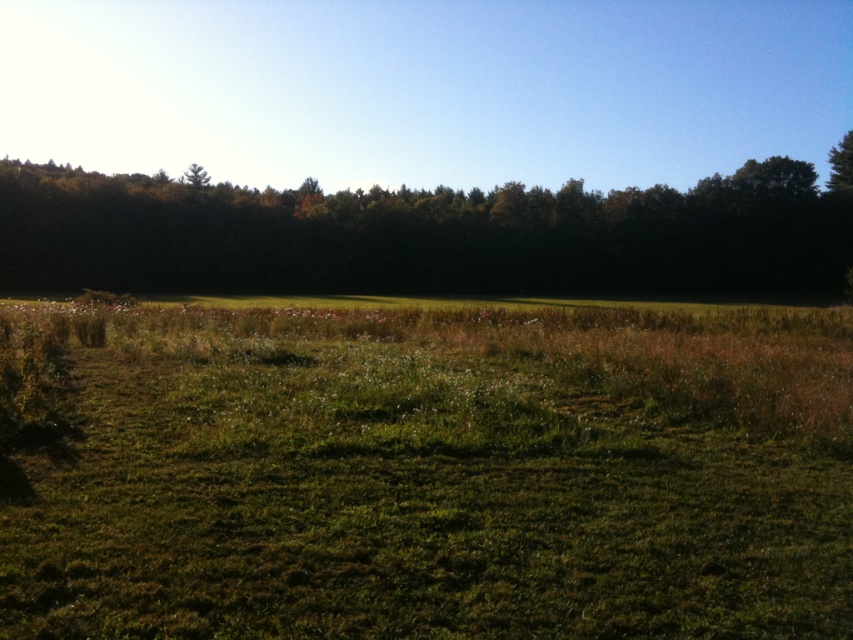
Question: Is green grassy field at center smaller than green leafy tree at upper center?

Choices:
 (A) yes
 (B) no

Answer: (A)

Question: Can you confirm if green grassy field at center is positioned above green leafy tree at upper center?

Choices:
 (A) no
 (B) yes

Answer: (A)

Question: Which point is farther to the camera?

Choices:
 (A) green grassy field at center
 (B) green leafy tree at upper center

Answer: (B)

Question: Is green grassy field at center above green leafy tree at upper center?

Choices:
 (A) yes
 (B) no

Answer: (B)

Question: Which object is closer to the camera taking this photo?

Choices:
 (A) green leafy tree at upper center
 (B) green grassy field at center

Answer: (B)